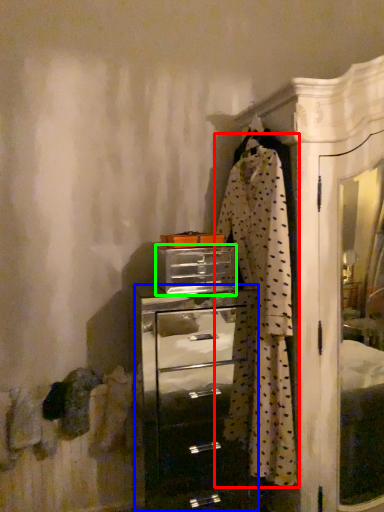
Question: Which object is positioned closest to clothing (highlighted by a red box)? Select from chest of drawers (highlighted by a blue box) and drawer (highlighted by a green box).

Choices:
 (A) chest of drawers
 (B) drawer

Answer: (B)